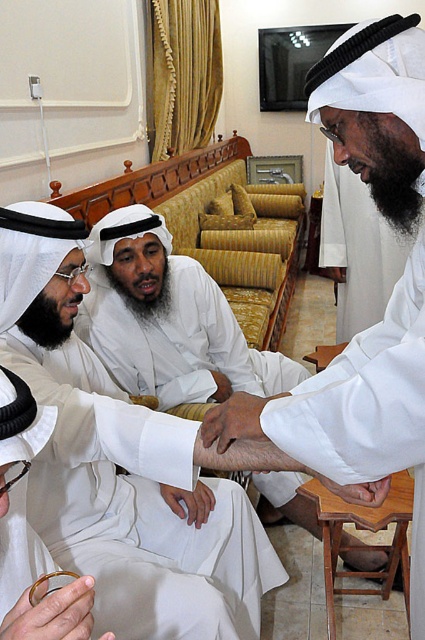
Question: Is wooden stool at lower right further to camera compared to matte white hand at center?

Choices:
 (A) no
 (B) yes

Answer: (B)

Question: Can you confirm if white satin robe at center is smaller than matte white hand at center?

Choices:
 (A) yes
 (B) no

Answer: (B)

Question: Which of the following is the farthest from the observer?

Choices:
 (A) (362, 493)
 (B) (17, 372)
 (C) (220, 440)
 (D) (368, 518)

Answer: (D)

Question: Considering the real-world distances, which object is closest to the smooth skin hand at lower right?

Choices:
 (A) wooden stool at lower right
 (B) white satin robe at center

Answer: (B)

Question: Can you confirm if white satin robe at center is bigger than white matte robe at center?

Choices:
 (A) no
 (B) yes

Answer: (B)

Question: Which of the following is the farthest from the observer?

Choices:
 (A) white matte robe at center
 (B) matte white hand at center

Answer: (B)